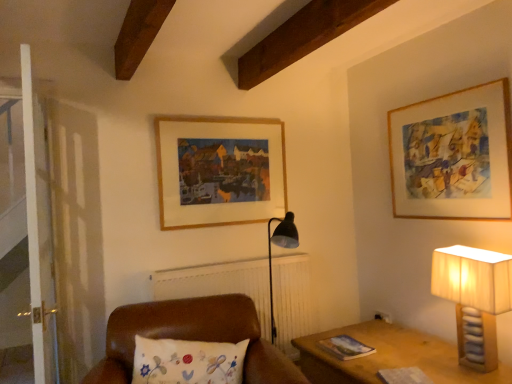
Question: From the image's perspective, is wooden picture frame at upper center, arranged as the 2th picture frame when viewed from the right, on leather cushion at center?

Choices:
 (A) yes
 (B) no

Answer: (A)

Question: Is wooden picture frame at upper center, arranged as the 2th picture frame when viewed from the right, looking in the opposite direction of leather cushion at center?

Choices:
 (A) no
 (B) yes

Answer: (A)

Question: Is wooden picture frame at upper center, arranged as the 2th picture frame when viewed from the right, behind leather cushion at center?

Choices:
 (A) yes
 (B) no

Answer: (A)

Question: Is leather cushion at center inside wooden picture frame at upper center, placed as the first picture frame when sorted from left to right?

Choices:
 (A) yes
 (B) no

Answer: (B)

Question: Is wooden picture frame at upper center, arranged as the 2th picture frame when viewed from the right, not inside leather cushion at center?

Choices:
 (A) yes
 (B) no

Answer: (A)

Question: Can you confirm if wooden picture frame at upper center, arranged as the 2th picture frame when viewed from the right, is bigger than leather cushion at center?

Choices:
 (A) no
 (B) yes

Answer: (A)

Question: Could you tell me if leather cushion at center is turned towards beige fabric lampshade at right?

Choices:
 (A) yes
 (B) no

Answer: (B)

Question: From the image's perspective, is leather cushion at center on top of beige fabric lampshade at right?

Choices:
 (A) yes
 (B) no

Answer: (B)

Question: Can you confirm if leather cushion at center is wider than beige fabric lampshade at right?

Choices:
 (A) no
 (B) yes

Answer: (B)

Question: Considering the relative positions of leather cushion at center and beige fabric lampshade at right in the image provided, is leather cushion at center behind beige fabric lampshade at right?

Choices:
 (A) no
 (B) yes

Answer: (A)

Question: Does leather cushion at center have a larger size compared to beige fabric lampshade at right?

Choices:
 (A) no
 (B) yes

Answer: (B)

Question: Is leather cushion at center to the right of beige fabric lampshade at right from the viewer's perspective?

Choices:
 (A) no
 (B) yes

Answer: (A)

Question: Is leather cushion at center at the back of wooden frame at upper right, the second picture frame in the left-to-right sequence?

Choices:
 (A) no
 (B) yes

Answer: (A)